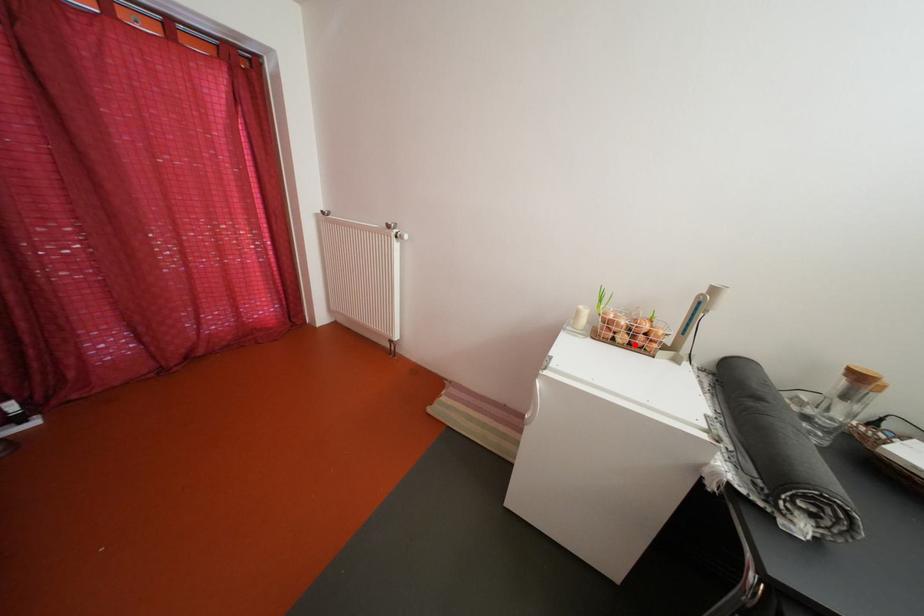
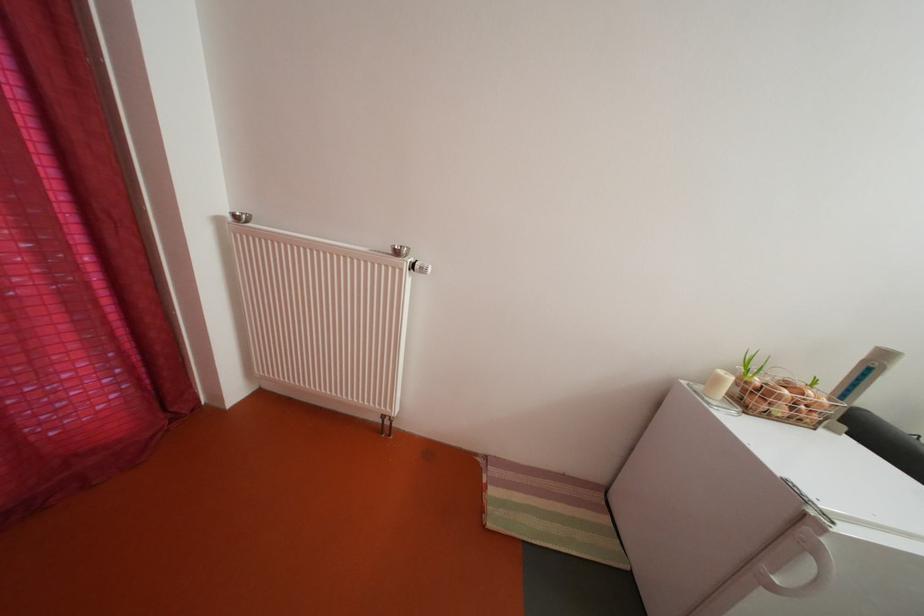
Find the pixel in the second image that matches the highlighted location in the first image.

(792, 416)